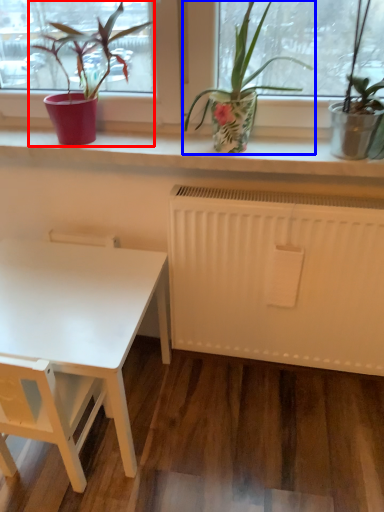
Question: Among these objects, which one is farthest to the camera, houseplant (highlighted by a red box) or houseplant (highlighted by a blue box)?

Choices:
 (A) houseplant
 (B) houseplant

Answer: (A)